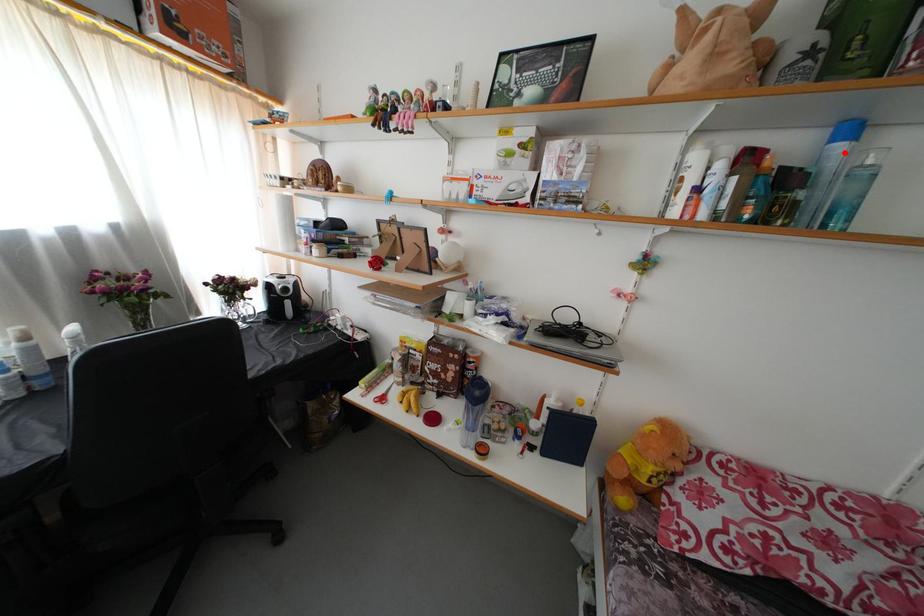
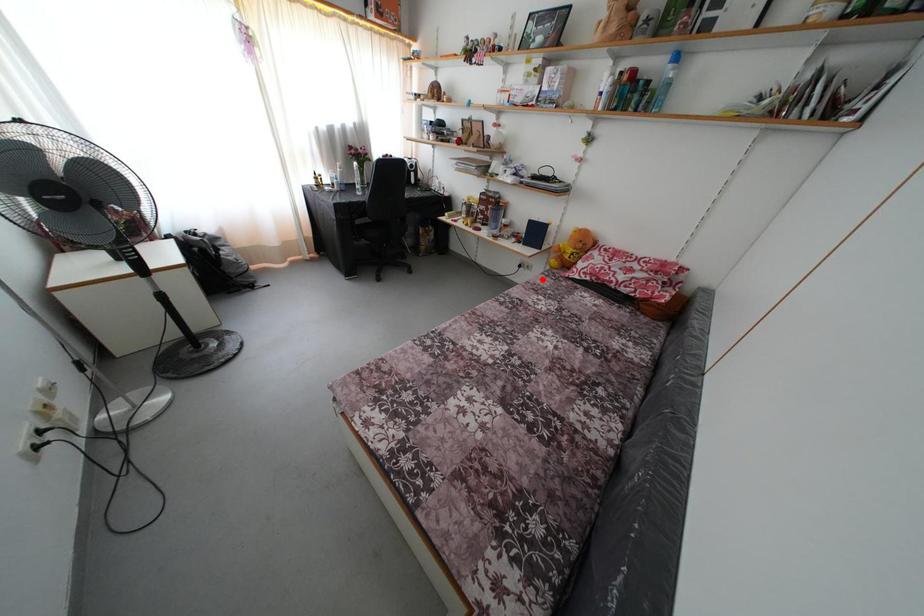
I am providing you with two images of the same scene from different viewpoints. A red point is marked on the first image and another point is marked on the second image. Is the red point in image1 aligned with the point shown in image2?

No